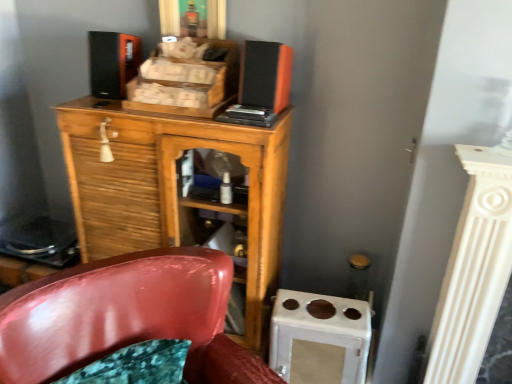
Identify the location of vacant area that is in front of matte black speaker at upper left, the second speaker positioned from the right. (90, 107).